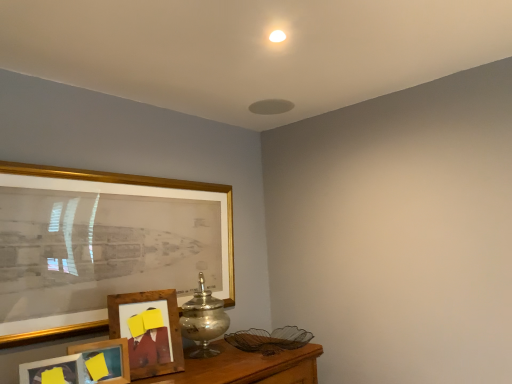
Question: Is the position of silver metallic vase at center more distant than that of gold framed picture at left, which is the third picture frame from front to back?

Choices:
 (A) yes
 (B) no

Answer: (A)

Question: Can you confirm if silver metallic vase at center is bigger than gold framed picture at left, the second picture frame in the back-to-front sequence?

Choices:
 (A) yes
 (B) no

Answer: (B)

Question: Does silver metallic vase at center have a lesser height compared to gold framed picture at left, which is the third picture frame from front to back?

Choices:
 (A) yes
 (B) no

Answer: (A)

Question: From a real-world perspective, does silver metallic vase at center stand above gold framed picture at left, which is the third picture frame from front to back?

Choices:
 (A) yes
 (B) no

Answer: (B)

Question: Is the surface of silver metallic vase at center in direct contact with gold framed picture at left, the second picture frame in the back-to-front sequence?

Choices:
 (A) no
 (B) yes

Answer: (A)

Question: Does silver metallic vase at center appear on the left side of gold framed picture at left, the second picture frame in the back-to-front sequence?

Choices:
 (A) no
 (B) yes

Answer: (A)

Question: Considering the relative sizes of wooden picture frame at lower left, positioned as the fourth picture frame in front-to-back order, and silver metallic vase at center in the image provided, is wooden picture frame at lower left, positioned as the fourth picture frame in front-to-back order, taller than silver metallic vase at center?

Choices:
 (A) no
 (B) yes

Answer: (A)

Question: Is wooden picture frame at lower left, positioned as the fourth picture frame in front-to-back order, in contact with silver metallic vase at center?

Choices:
 (A) yes
 (B) no

Answer: (B)

Question: Is wooden picture frame at lower left, positioned as the fourth picture frame in front-to-back order, aimed at silver metallic vase at center?

Choices:
 (A) yes
 (B) no

Answer: (B)

Question: From a real-world perspective, is wooden picture frame at lower left, positioned as the fourth picture frame in front-to-back order, on silver metallic vase at center?

Choices:
 (A) yes
 (B) no

Answer: (B)

Question: Considering the relative sizes of wooden picture frame at lower left, positioned as the fourth picture frame in front-to-back order, and silver metallic vase at center in the image provided, is wooden picture frame at lower left, positioned as the fourth picture frame in front-to-back order, bigger than silver metallic vase at center?

Choices:
 (A) yes
 (B) no

Answer: (B)

Question: Is wooden picture frame at lower left, positioned as the fourth picture frame in front-to-back order, smaller than silver metallic vase at center?

Choices:
 (A) no
 (B) yes

Answer: (B)

Question: Can you confirm if gold framed picture at left, which is the third picture frame from front to back, is taller than wooden photo frame at lower left, marked as the 1th picture frame in a front-to-back arrangement?

Choices:
 (A) yes
 (B) no

Answer: (A)